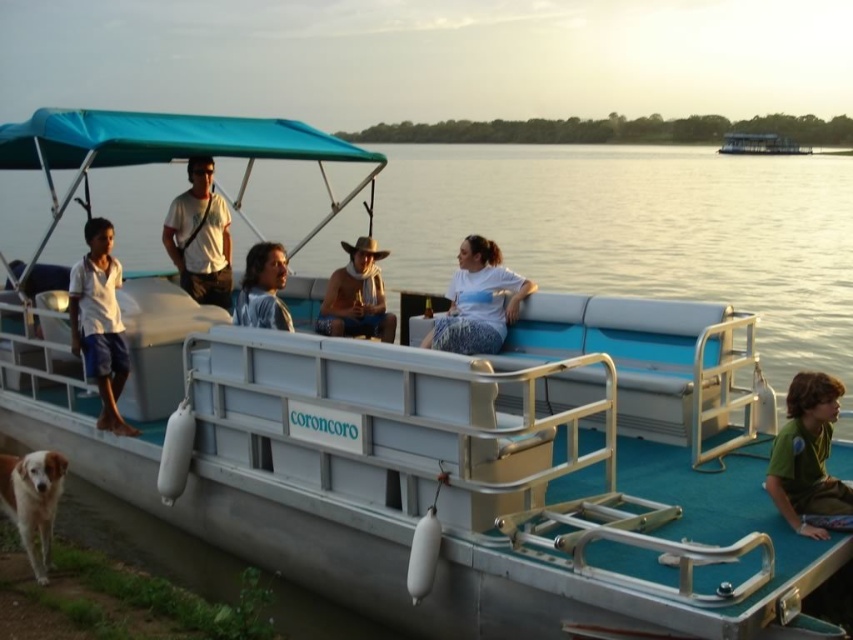
Consider the image. You are a photographer on the lakeshore and want to capture both the shiny metallic cowboy hat at center and the blue plastic boat at center in a single shot. However, you notice that one object is taller than the other. Which object will appear larger in the photo?

The shiny metallic cowboy hat at center is taller than the blue plastic boat at center, so it will appear larger in the photo.

You are a photographer planning to take a photo of the shiny metallic cowboy hat at center and the blue plastic boat at center. Which object should you focus on first if you want to ensure both are in sharp focus?

The shiny metallic cowboy hat at center is positioned under the blue plastic boat at center, so focusing on the blue plastic boat at center first will ensure both are in sharp focus because it is farther away from the camera.

You are a photographer positioned on the lakeside dock and want to capture both the white matte shirt at left and the matte black shirt at center in a single photo. Which person should you focus on first to ensure both are in frame?

You should focus on the white matte shirt at left first because it is closer to you than the matte black shirt at center, ensuring both are in frame.